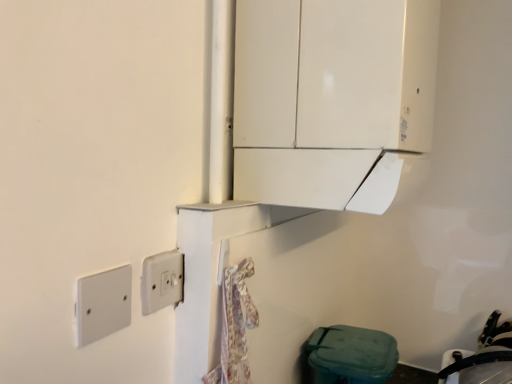
Question: From a real-world perspective, is white glossy cabinet at upper center over white plastic light switch at center, acting as the second light switch starting from the left?

Choices:
 (A) yes
 (B) no

Answer: (A)

Question: From the image's perspective, is white glossy cabinet at upper center below white plastic light switch at center, the first light switch in the right-to-left sequence?

Choices:
 (A) yes
 (B) no

Answer: (B)

Question: Can you confirm if white glossy cabinet at upper center is taller than white plastic light switch at center, acting as the second light switch starting from the left?

Choices:
 (A) yes
 (B) no

Answer: (A)

Question: Can you confirm if white glossy cabinet at upper center is positioned to the right of white plastic light switch at center, acting as the second light switch starting from the left?

Choices:
 (A) no
 (B) yes

Answer: (B)

Question: Is white glossy cabinet at upper center located outside white plastic light switch at center, which is the 2th light switch from front to back?

Choices:
 (A) yes
 (B) no

Answer: (A)

Question: From a real-world perspective, is white glossy cabinet at upper center physically below white plastic light switch at center, the first light switch in the right-to-left sequence?

Choices:
 (A) yes
 (B) no

Answer: (B)

Question: Is white glossy cabinet at upper center not within white plastic/light switch at lower left, the first light switch viewed from the left?

Choices:
 (A) no
 (B) yes

Answer: (B)

Question: Can you confirm if white glossy cabinet at upper center is shorter than white plastic/light switch at lower left, which ranks as the 1th light switch in front-to-back order?

Choices:
 (A) no
 (B) yes

Answer: (A)

Question: From a real-world perspective, is white glossy cabinet at upper center positioned under white plastic/light switch at lower left, the first light switch viewed from the left, based on gravity?

Choices:
 (A) no
 (B) yes

Answer: (A)

Question: Is white glossy cabinet at upper center at the right side of white plastic/light switch at lower left, the first light switch viewed from the left?

Choices:
 (A) no
 (B) yes

Answer: (B)

Question: Does white glossy cabinet at upper center have a greater height compared to white plastic/light switch at lower left, the first light switch viewed from the left?

Choices:
 (A) no
 (B) yes

Answer: (B)

Question: From the image's perspective, is white glossy cabinet at upper center on top of white plastic/light switch at lower left, positioned as the second light switch in back-to-front order?

Choices:
 (A) yes
 (B) no

Answer: (A)

Question: Can you confirm if black rubber sink at lower right is bigger than white plastic/light switch at lower left, the first light switch viewed from the left?

Choices:
 (A) no
 (B) yes

Answer: (B)